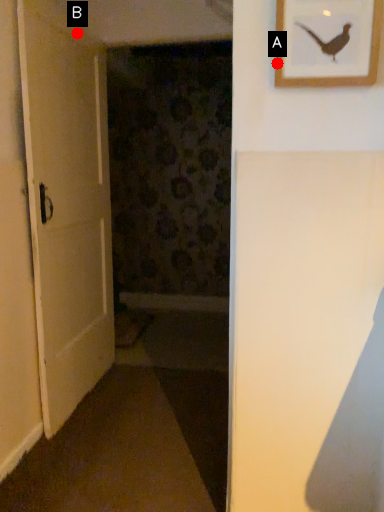
Question: Two points are circled on the image, labeled by A and B beside each circle. Which point is farther from the camera taking this photo?

Choices:
 (A) A is further
 (B) B is further

Answer: (B)